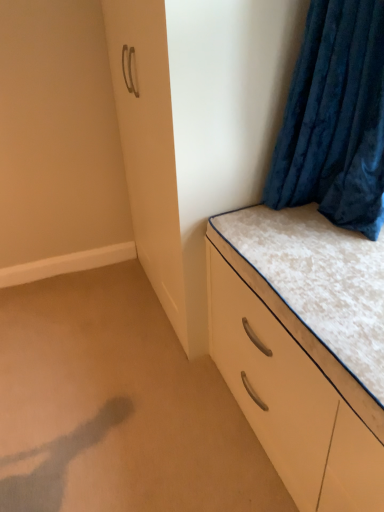
Question: Is point (29, 401) closer or farther from the camera than point (322, 400)?

Choices:
 (A) farther
 (B) closer

Answer: (A)

Question: Based on their sizes in the image, would you say beige carpet at lower left is bigger or smaller than white glossy chest of drawers at lower right?

Choices:
 (A) small
 (B) big

Answer: (A)

Question: Which is farther from the white glossy chest of drawers at lower right?

Choices:
 (A) beige carpet at lower left
 (B) velvet blue curtain at upper right

Answer: (A)

Question: Considering the real-world distances, which object is closest to the beige carpet at lower left?

Choices:
 (A) velvet blue curtain at upper right
 (B) white glossy chest of drawers at lower right

Answer: (B)